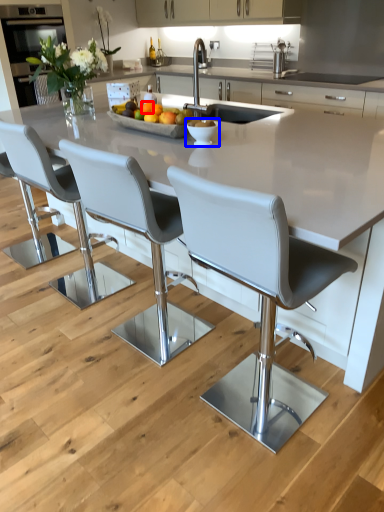
Question: Which of the following is the farthest to the observer, orange (highlighted by a red box) or bowl (highlighted by a blue box)?

Choices:
 (A) orange
 (B) bowl

Answer: (A)